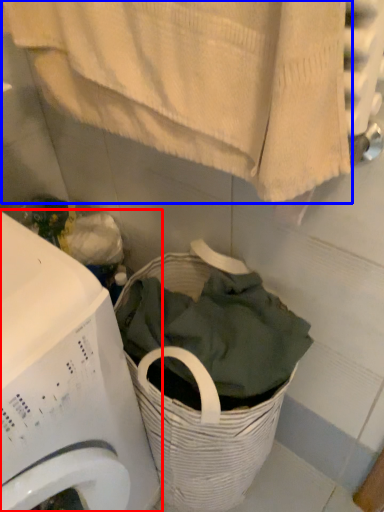
Question: Which object appears farthest to the camera in this image, washing machine (highlighted by a red box) or bath towel (highlighted by a blue box)?

Choices:
 (A) washing machine
 (B) bath towel

Answer: (A)